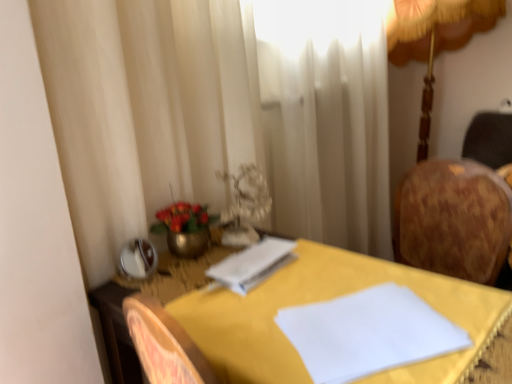
Looking at this image, measure the distance between metallic gold vase at center and camera.

They are 1.09 meters apart.

Describe the element at coordinates (253, 264) in the screenshot. This screenshot has width=512, height=384. I see `white paper at center` at that location.

Image resolution: width=512 pixels, height=384 pixels. What do you see at coordinates (434, 39) in the screenshot?
I see `gold fabric lampshade at upper right` at bounding box center [434, 39].

Locate an element on the screen. The height and width of the screenshot is (384, 512). metallic gold vase at center is located at coordinates (184, 228).

From the image's perspective, is yellow fabric-covered table at center over white paper at center?

Incorrect, from the image's perspective, yellow fabric-covered table at center is lower than white paper at center.

Which of these two, yellow fabric-covered table at center or white paper at center, stands taller?

Standing taller between the two is yellow fabric-covered table at center.

Is yellow fabric-covered table at center looking in the opposite direction of white paper at center?

No, yellow fabric-covered table at center's orientation is not away from white paper at center.

Considering the points (297, 278) and (211, 285), which point is in front, point (297, 278) or point (211, 285)?

Positioned in front is point (297, 278).

Is white paper at center spatially inside yellow fabric-covered table at center, or outside of it?

white paper at center exists entirely within yellow fabric-covered table at center.

In the image, there is a yellow fabric-covered table at center. Identify the location of notepad above it (from the image's perspective). The height and width of the screenshot is (384, 512). (253, 264).

In the image, is white paper at center positioned in front of or behind yellow fabric-covered table at center?

Visually, white paper at center is located behind yellow fabric-covered table at center.

Considering the points (161, 219) and (302, 278), which point is in front, point (161, 219) or point (302, 278)?

The point (302, 278) is more forward.

Identify the location of table below the metallic gold vase at center (from a real-world perspective). (292, 305).

Considering the sizes of metallic gold vase at center and yellow fabric-covered table at center in the image, is metallic gold vase at center taller or shorter than yellow fabric-covered table at center?

In the image, metallic gold vase at center appears to be shorter than yellow fabric-covered table at center.

From the image's perspective, is yellow fabric-covered table at center located above or below gold fabric lampshade at upper right?

Clearly, from the image's perspective, yellow fabric-covered table at center is below gold fabric lampshade at upper right.

Find the location of a particular element. table below the gold fabric lampshade at upper right (from the image's perspective) is located at coordinates (292, 305).

Is yellow fabric-covered table at center not within gold fabric lampshade at upper right?

Yes, yellow fabric-covered table at center is not within gold fabric lampshade at upper right.

Considering the sizes of objects metallic gold vase at center and white paper at center in the image provided, who is wider, metallic gold vase at center or white paper at center?

metallic gold vase at center.

Consider the image. Considering the sizes of metallic gold vase at center and white paper at center in the image, is metallic gold vase at center taller or shorter than white paper at center?

In the image, metallic gold vase at center appears to be taller than white paper at center.

Considering the points (198, 237) and (290, 244), which point is in front, point (198, 237) or point (290, 244)?

Point (198, 237)

At what (x,y) coordinates should I click in order to perform the action: click on notepad that appears below the metallic gold vase at center (from a real-world perspective). Please return your answer as a coordinate pair (x, y). Looking at the image, I should click on (253, 264).

Is white paper at center shorter than gold fabric lampshade at upper right?

Yes, white paper at center is shorter than gold fabric lampshade at upper right.

From a real-world perspective, is white paper at center positioned over gold fabric lampshade at upper right based on gravity?

Actually, white paper at center is physically below gold fabric lampshade at upper right in the real world.

Is white paper at center facing towards gold fabric lampshade at upper right?

No, white paper at center is not oriented towards gold fabric lampshade at upper right.

Considering the positions of point (276, 268) and point (490, 16), is point (276, 268) closer or farther from the camera than point (490, 16)?

Point (276, 268) is closer to the camera than point (490, 16).

Which object is further away from the camera taking this photo, gold fabric lampshade at upper right or yellow fabric-covered table at center?

gold fabric lampshade at upper right is further from the camera.

Is yellow fabric-covered table at center at the back of gold fabric lampshade at upper right?

That's not correct — gold fabric lampshade at upper right is not looking away from yellow fabric-covered table at center.

Do you think gold fabric lampshade at upper right is within yellow fabric-covered table at center, or outside of it?

gold fabric lampshade at upper right exists outside the volume of yellow fabric-covered table at center.

Locate an element on the screen. table below the white paper at center (from the image's perspective) is located at coordinates (x=292, y=305).

Identify the location of notepad above the yellow fabric-covered table at center (from the image's perspective). This screenshot has height=384, width=512. (253, 264).

Based on their spatial positions, is yellow fabric-covered table at center or white paper at center closer to gold fabric lampshade at upper right?

white paper at center.

When comparing their distances from yellow fabric-covered table at center, does metallic gold vase at center or white paper at center seem further?

metallic gold vase at center lies further to yellow fabric-covered table at center than the other object.

Consider the image. Estimate the real-world distances between objects in this image. Which object is closer to metallic gold vase at center, white paper at center or gold fabric lampshade at upper right?

white paper at center is positioned closer to the anchor metallic gold vase at center.

Based on their spatial positions, is white paper at center or metallic gold vase at center further from yellow fabric-covered table at center?

metallic gold vase at center is further to yellow fabric-covered table at center.

From the image, which object appears to be nearer to yellow fabric-covered table at center, metallic gold vase at center or gold fabric lampshade at upper right?

Based on the image, metallic gold vase at center appears to be nearer to yellow fabric-covered table at center.

Which object lies nearer to the anchor point white paper at center, yellow fabric-covered table at center or metallic gold vase at center?

Based on the image, metallic gold vase at center appears to be nearer to white paper at center.

Based on the photo, looking at the image, which one is located closer to white paper at center, yellow fabric-covered table at center or gold fabric lampshade at upper right?

The object closer to white paper at center is yellow fabric-covered table at center.

From the image, which object appears to be farther from yellow fabric-covered table at center, white paper at center or gold fabric lampshade at upper right?

gold fabric lampshade at upper right is positioned further to the anchor yellow fabric-covered table at center.

Where is `notepad between metallic gold vase at center and gold fabric lampshade at upper right`? The height and width of the screenshot is (384, 512). notepad between metallic gold vase at center and gold fabric lampshade at upper right is located at coordinates (253, 264).

Locate an element on the screen. Image resolution: width=512 pixels, height=384 pixels. notepad located between yellow fabric-covered table at center and metallic gold vase at center in the depth direction is located at coordinates (253, 264).

The width and height of the screenshot is (512, 384). What are the coordinates of `notepad between yellow fabric-covered table at center and gold fabric lampshade at upper right along the z-axis` in the screenshot? It's located at (253, 264).

Image resolution: width=512 pixels, height=384 pixels. I want to click on table located between metallic gold vase at center and gold fabric lampshade at upper right in the left-right direction, so click(292, 305).